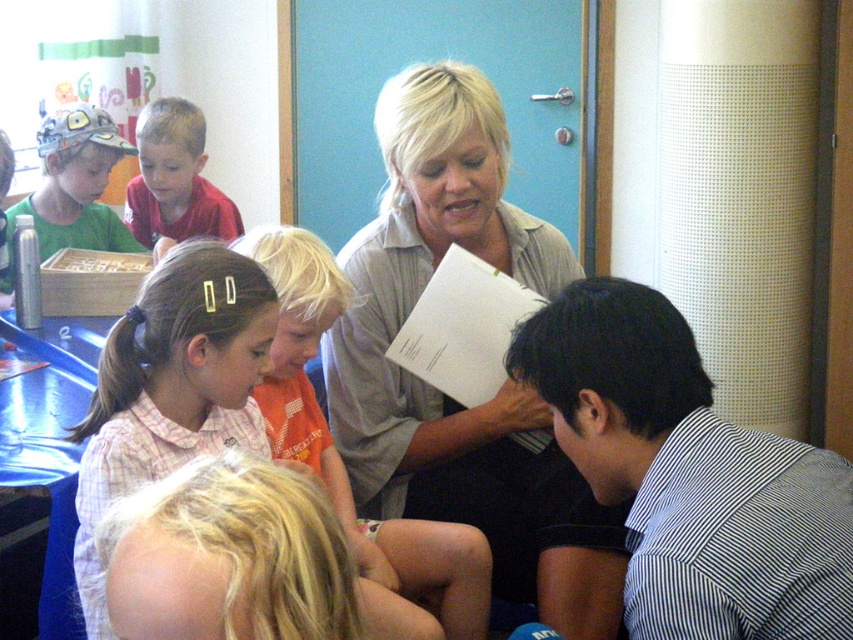
Is light beige shirt at center shorter than matte red shirt at upper left?

Answer: No, light beige shirt at center is not shorter than matte red shirt at upper left.

Can you confirm if light beige shirt at center is thinner than matte red shirt at upper left?

Incorrect, light beige shirt at center's width is not less than matte red shirt at upper left's.

Between point (514, 392) and point (137, 237), which one is positioned in front?

Point (514, 392)

Identify the location of light beige shirt at center. (439, 392).

Which is behind, point (334, 364) or point (461, 596)?

The point (334, 364) is behind.

Is light beige shirt at center smaller than orange cotton shirt at center?

No.

Measure the distance between light beige shirt at center and camera.

1.65 meters

You are a GUI agent. You are given a task and a screenshot of the screen. Output one action in this format:
    pyautogui.click(x=<x>, y=<y>)
    Task: Click on the light beige shirt at center
    Image resolution: width=853 pixels, height=640 pixels.
    Given the screenshot: What is the action you would take?
    pyautogui.click(x=439, y=392)

Does black striped shirt at lower right have a lesser height compared to orange cotton shirt at center?

Correct, black striped shirt at lower right is not as tall as orange cotton shirt at center.

Which is behind, point (712, 435) or point (312, 321)?

The point (312, 321) is behind.

Identify the location of black striped shirt at lower right. (689, 474).

Identify the location of black striped shirt at lower right. This screenshot has height=640, width=853. (689, 474).